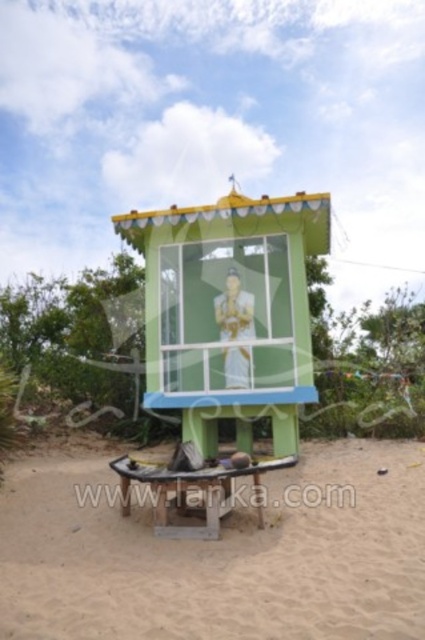
Measure the distance between sandy brown sand at lower center and camera.

sandy brown sand at lower center is 5.03 meters away from camera.

Based on the photo, can you confirm if sandy brown sand at lower center is shorter than wooden picnic table at center?

Yes.

Between point (268, 572) and point (257, 490), which one is positioned behind?

Point (257, 490)

Locate an element on the screen. sandy brown sand at lower center is located at coordinates (218, 557).

Is point (274, 404) in front of point (221, 468)?

No.

Does green painted wood at center lie behind wooden picnic table at center?

Yes, it is behind wooden picnic table at center.

Is point (158, 353) behind point (206, 522)?

Yes, it is behind point (206, 522).

Image resolution: width=425 pixels, height=640 pixels. Find the location of `green painted wood at center`. green painted wood at center is located at coordinates (229, 310).

Between sandy brown sand at lower center and green painted wood at center, which one appears on the right side from the viewer's perspective?

Positioned to the right is green painted wood at center.

You are a GUI agent. You are given a task and a screenshot of the screen. Output one action in this format:
    pyautogui.click(x=<x>, y=<y>)
    Task: Click on the sandy brown sand at lower center
    
    Given the screenshot: What is the action you would take?
    pyautogui.click(x=218, y=557)

Find the location of a particular element. sandy brown sand at lower center is located at coordinates [218, 557].